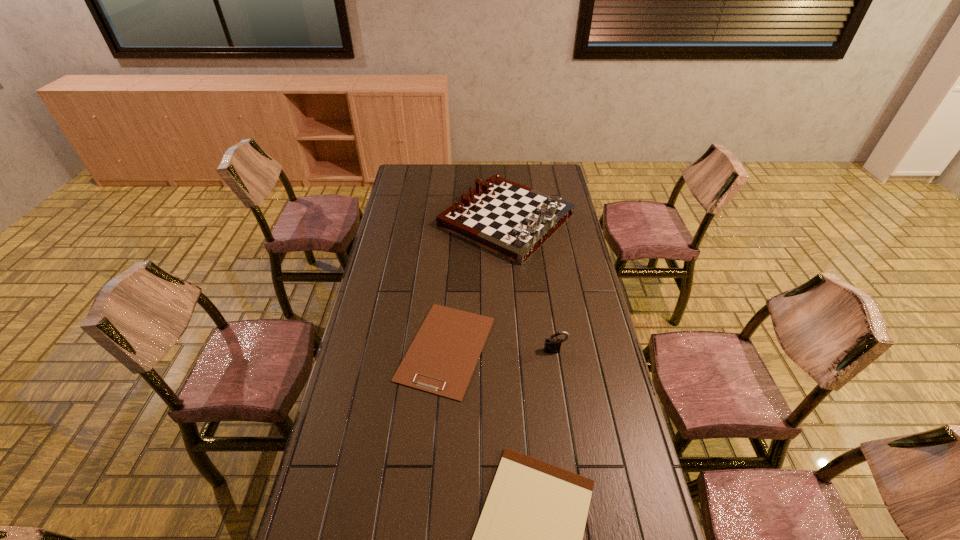
Locate an element on the screen. The height and width of the screenshot is (540, 960). gameboard is located at coordinates (509, 219).

At what (x,y) coordinates should I click in order to perform the action: click on the farthest object. Please return your answer as a coordinate pair (x, y). Image resolution: width=960 pixels, height=540 pixels. Looking at the image, I should click on [509, 219].

Where is `the third shortest object`? This screenshot has height=540, width=960. the third shortest object is located at coordinates (552, 345).

Image resolution: width=960 pixels, height=540 pixels. In order to click on the taller clipboard in this screenshot , I will do `click(441, 360)`.

The width and height of the screenshot is (960, 540). In order to click on the farther clipboard in this screenshot , I will do `click(441, 360)`.

Locate an element on the screen. This screenshot has width=960, height=540. vacant space located 0.090m on the left of the gameboard is located at coordinates (419, 220).

The image size is (960, 540). What are the coordinates of `free region located with the keyhole on the front of the padlock` in the screenshot? It's located at (564, 413).

I want to click on vacant region located on the right of the farther clipboard, so click(x=529, y=348).

What are the coordinates of `object that is at the far edge` in the screenshot? It's located at (509, 219).

What are the coordinates of `object situated at the left edge` in the screenshot? It's located at (441, 360).